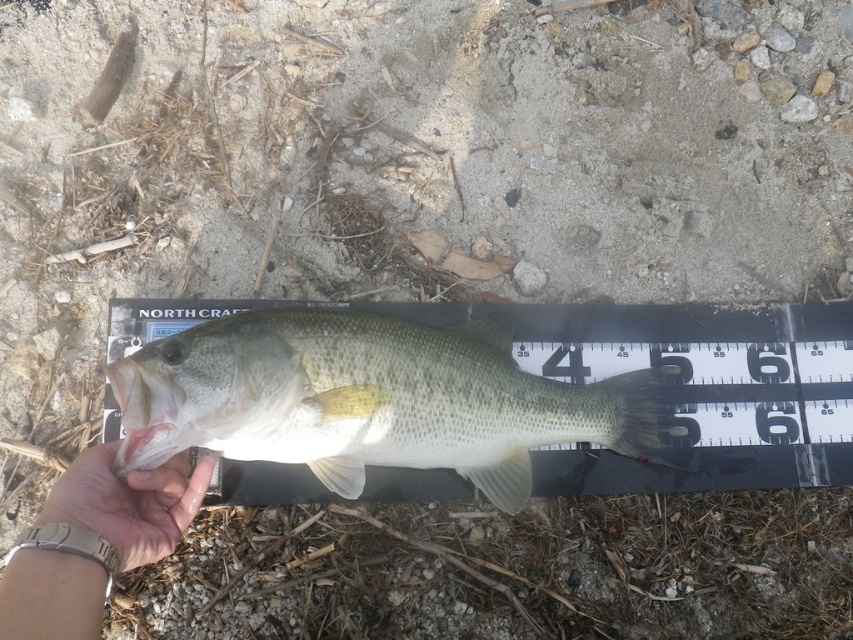
Does green matte fish at center appear on the right side of satin gold watch at lower left?

Indeed, green matte fish at center is positioned on the right side of satin gold watch at lower left.

Can you confirm if green matte fish at center is wider than satin gold watch at lower left?

Yes.

Image resolution: width=853 pixels, height=640 pixels. I want to click on green matte fish at center, so click(370, 400).